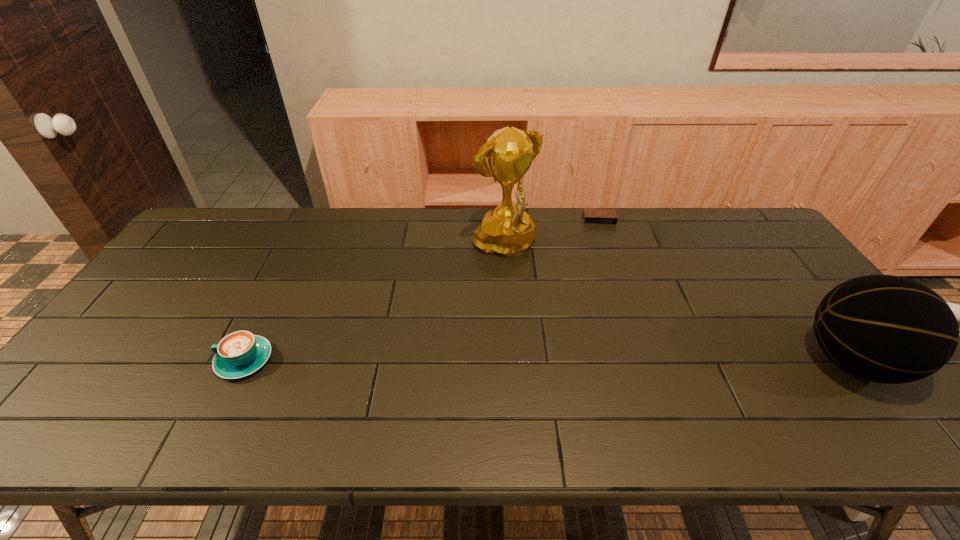
The height and width of the screenshot is (540, 960). In order to click on vacant space that is in between the tallest object and the leftmost object in this screenshot , I will do `click(375, 304)`.

Where is `vacant area that lies between the second object from left to right and the second object from right to left`? vacant area that lies between the second object from left to right and the second object from right to left is located at coordinates (552, 234).

Locate an element on the screen. Image resolution: width=960 pixels, height=540 pixels. empty location between the shortest object and the basketball is located at coordinates click(726, 291).

Locate an element on the screen. The height and width of the screenshot is (540, 960). free spot between the shortest object and the leftmost object is located at coordinates (421, 290).

At what (x,y) coordinates should I click in order to perform the action: click on vacant area that lies between the second tallest object and the third object from left to right. Please return your answer as a coordinate pair (x, y). The height and width of the screenshot is (540, 960). Looking at the image, I should click on (726, 291).

This screenshot has height=540, width=960. I want to click on vacant area between the tallest object and the second object from right to left, so click(x=552, y=234).

The width and height of the screenshot is (960, 540). What are the coordinates of `vacant region between the second object from right to left and the leftmost object` in the screenshot? It's located at (421, 290).

Locate an element on the screen. Image resolution: width=960 pixels, height=540 pixels. free spot between the shortest object and the tallest object is located at coordinates (552, 234).

You are a GUI agent. You are given a task and a screenshot of the screen. Output one action in this format:
    pyautogui.click(x=<x>, y=<y>)
    Task: Click on the empty space between the shortest object and the basketball
    This screenshot has width=960, height=540.
    Given the screenshot: What is the action you would take?
    pyautogui.click(x=726, y=291)

Locate an element on the screen. This screenshot has height=540, width=960. free space between the second object from left to right and the shortest object is located at coordinates (552, 234).